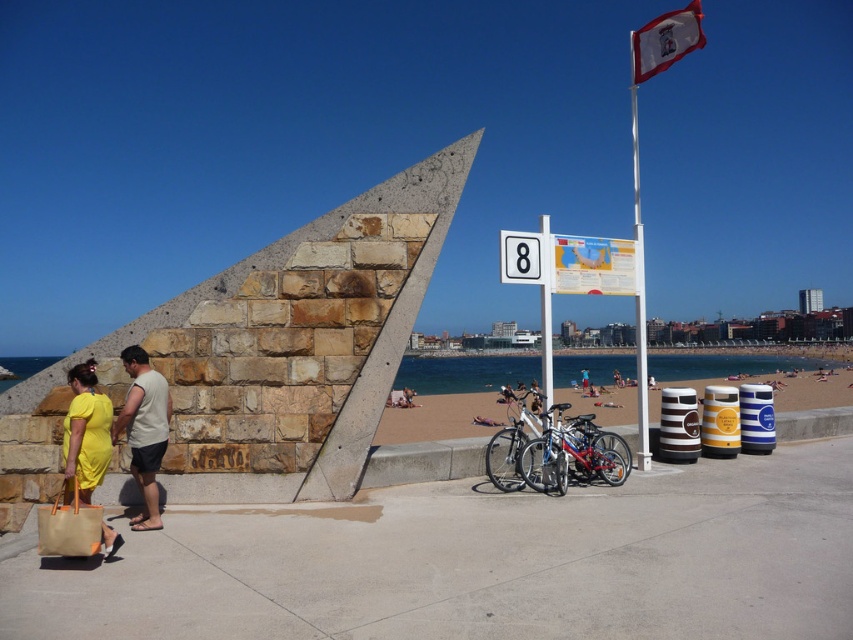
Is metallic silver bicycle at center below white plastic sign at center?

Yes, metallic silver bicycle at center is below white plastic sign at center.

Is metallic silver bicycle at center bigger than white plastic sign at center?

Actually, metallic silver bicycle at center might be smaller than white plastic sign at center.

Locate an element on the screen. The width and height of the screenshot is (853, 640). metallic silver bicycle at center is located at coordinates pyautogui.click(x=573, y=452).

Is metallic silver bicycle at center to the right of beige fabric tote at lower left from the viewer's perspective?

Yes, metallic silver bicycle at center is to the right of beige fabric tote at lower left.

In the scene shown: Who is positioned more to the right, metallic silver bicycle at center or beige fabric tote at lower left?

Positioned to the right is metallic silver bicycle at center.

Is point (529, 467) positioned in front of point (48, 552)?

No, (529, 467) is further to viewer.

Where is `metallic silver bicycle at center`? The width and height of the screenshot is (853, 640). metallic silver bicycle at center is located at coordinates (573, 452).

Who is lower down, yellow fabric bag at lower left or white fabric flag at upper right?

yellow fabric bag at lower left is lower down.

Is yellow fabric bag at lower left further to the viewer compared to white fabric flag at upper right?

No, it is not.

Find the location of a particular element. Image resolution: width=853 pixels, height=640 pixels. yellow fabric bag at lower left is located at coordinates (86, 432).